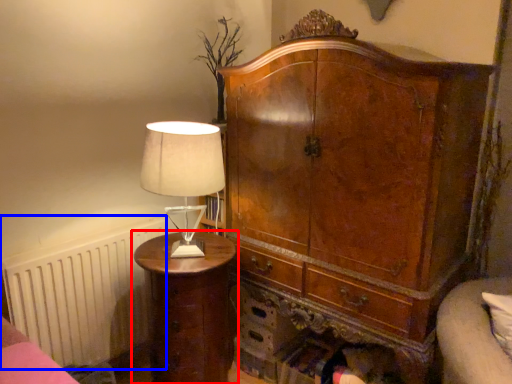
Question: Among these objects, which one is nearest to the camera, nightstand (highlighted by a red box) or radiator (highlighted by a blue box)?

Choices:
 (A) nightstand
 (B) radiator

Answer: (A)